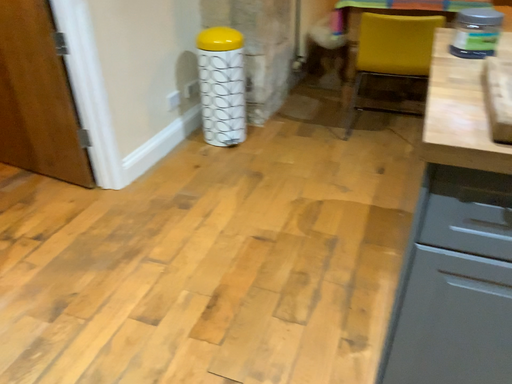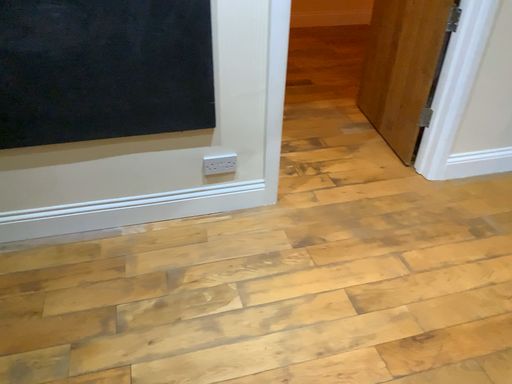
Question: Which way did the camera rotate in the video?

Choices:
 (A) rotated upward
 (B) rotated downward

Answer: (A)